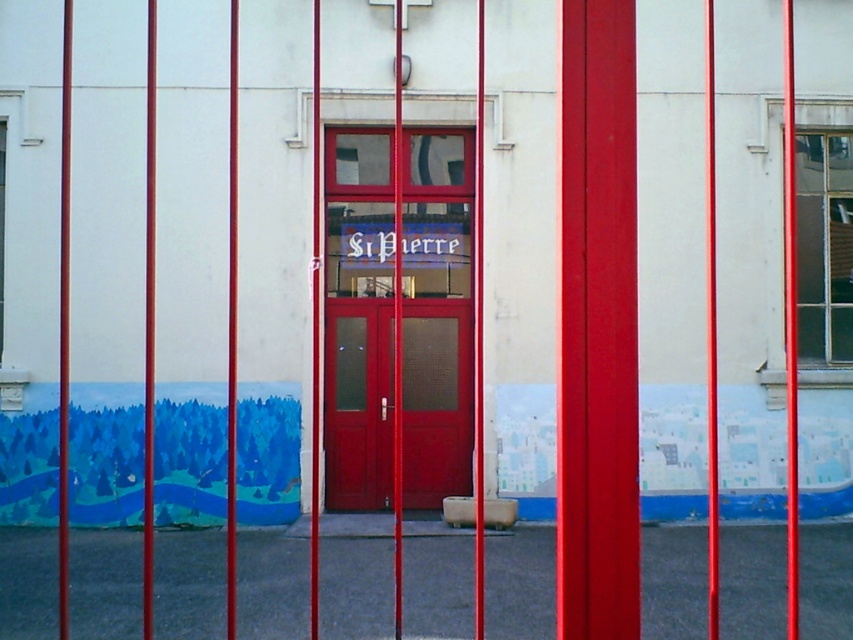
What do you see at coordinates (358, 403) in the screenshot? The width and height of the screenshot is (853, 640). I see `matte red door at center` at bounding box center [358, 403].

The width and height of the screenshot is (853, 640). Find the location of `matte red door at center`. matte red door at center is located at coordinates (358, 403).

This screenshot has width=853, height=640. In order to click on matte red door at center in this screenshot , I will do `click(358, 403)`.